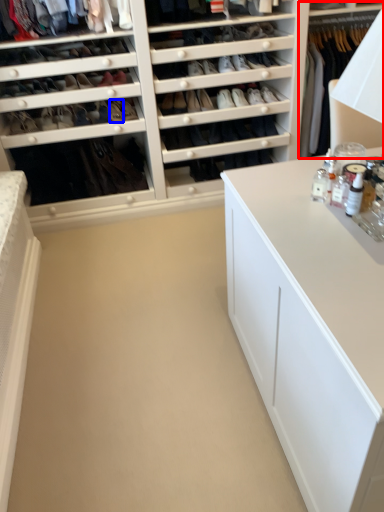
Question: Which object is closer to the camera taking this photo, dresser (highlighted by a red box) or shoe (highlighted by a blue box)?

Choices:
 (A) dresser
 (B) shoe

Answer: (A)